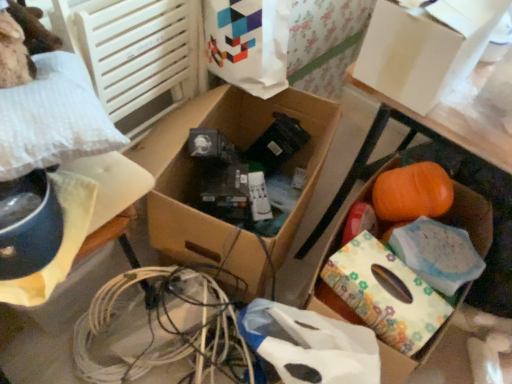
Where is `free space above floral-patterned paper at lower right (from a real-world perspective)`? Image resolution: width=512 pixels, height=384 pixels. free space above floral-patterned paper at lower right (from a real-world perspective) is located at coordinates (396, 274).